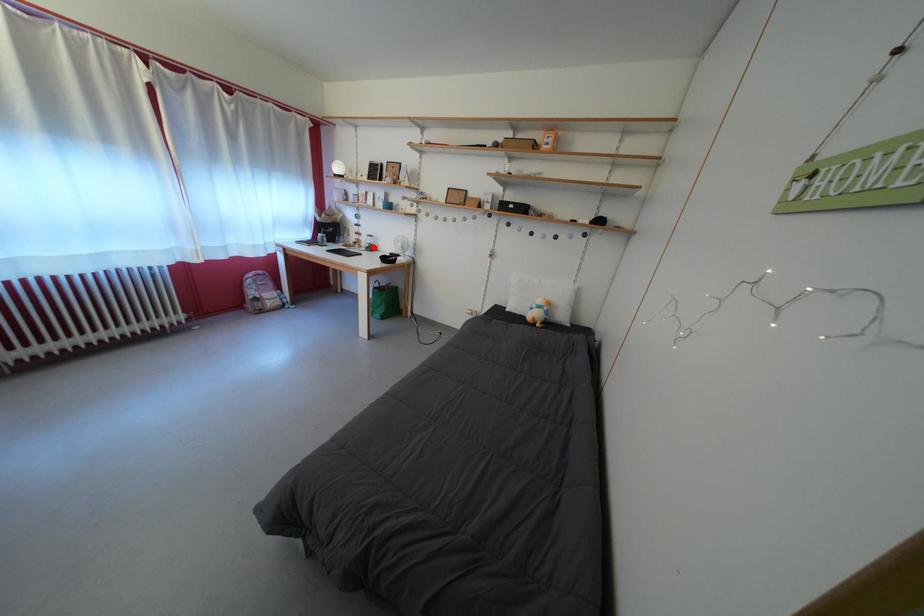
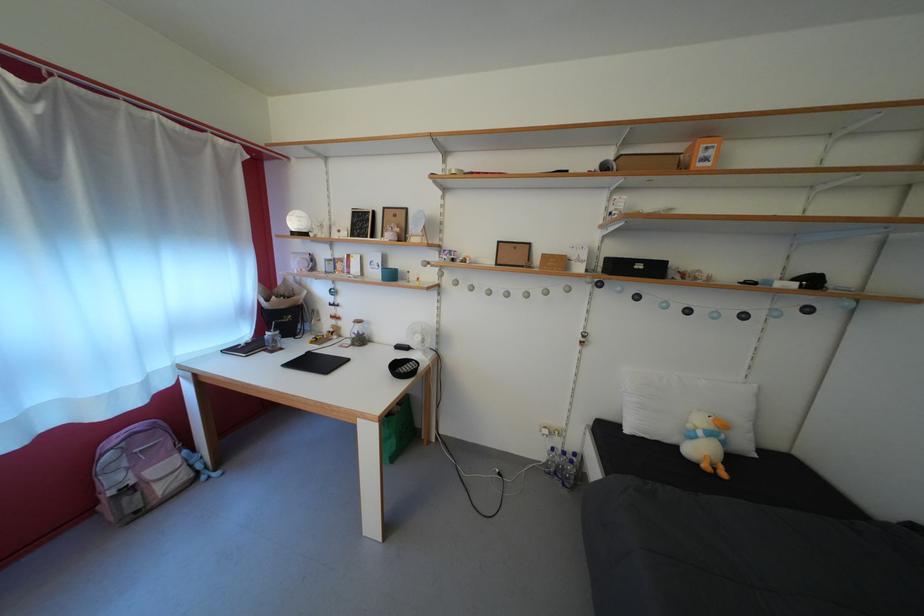
Question: A red point is marked in image1. In image2, is the corresponding 3D point closer to the camera or farther? Reply with the corresponding letter.

Choices:
 (A) The corresponding 3D point is closer.
 (B) The corresponding 3D point is farther.

Answer: (B)